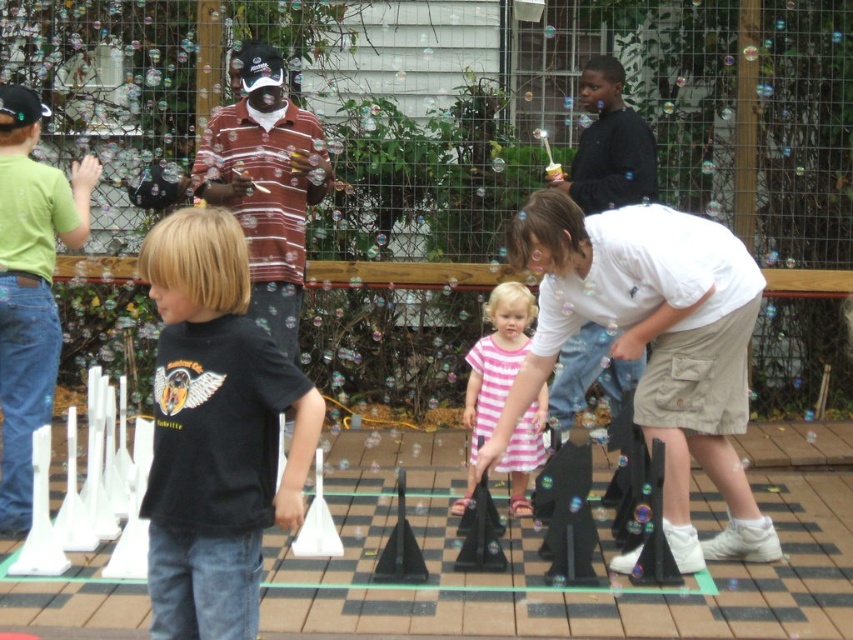
Based on the photo, does white cotton shirt at center appear on the right side of black matte shirt at center?

Indeed, white cotton shirt at center is positioned on the right side of black matte shirt at center.

Which is below, white cotton shirt at center or black matte shirt at center?

Positioned lower is white cotton shirt at center.

Where is `white cotton shirt at center`? This screenshot has width=853, height=640. white cotton shirt at center is located at coordinates (653, 344).

Can you confirm if white cotton shirt at center is positioned to the right of pink striped dress at center?

Yes, white cotton shirt at center is to the right of pink striped dress at center.

Can you confirm if white cotton shirt at center is positioned to the left of pink striped dress at center?

In fact, white cotton shirt at center is to the right of pink striped dress at center.

Locate an element on the screen. This screenshot has height=640, width=853. white cotton shirt at center is located at coordinates (653, 344).

I want to click on white cotton shirt at center, so click(x=653, y=344).

Which is behind, point (170, 388) or point (465, 417)?

Positioned behind is point (465, 417).

Does point (142, 500) come farther from viewer compared to point (508, 376)?

That is False.

Does point (310, 454) lie in front of point (518, 422)?

Yes, it is.

Image resolution: width=853 pixels, height=640 pixels. What are the coordinates of `black matte shirt at center` in the screenshot? It's located at (215, 432).